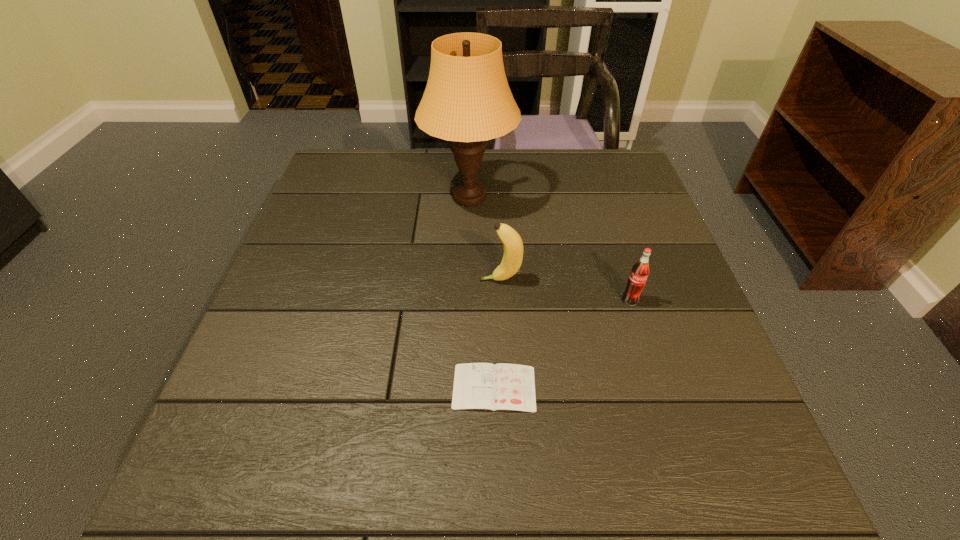
Identify the location of object that ranks as the third closest to the diary. This screenshot has height=540, width=960. (467, 100).

Identify the location of object that can be found as the closest to the rightmost object. Image resolution: width=960 pixels, height=540 pixels. (513, 246).

Where is `vacant space that satisfies the following two spatial constraints: 1. on the front side of the nearest object; 2. on the right side of the lampshade`? This screenshot has height=540, width=960. vacant space that satisfies the following two spatial constraints: 1. on the front side of the nearest object; 2. on the right side of the lampshade is located at coordinates (465, 388).